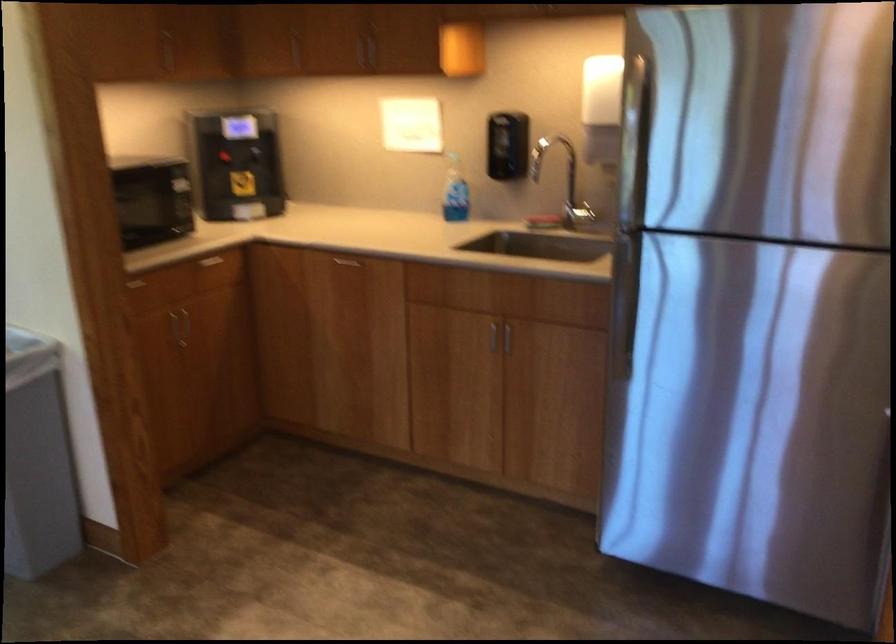
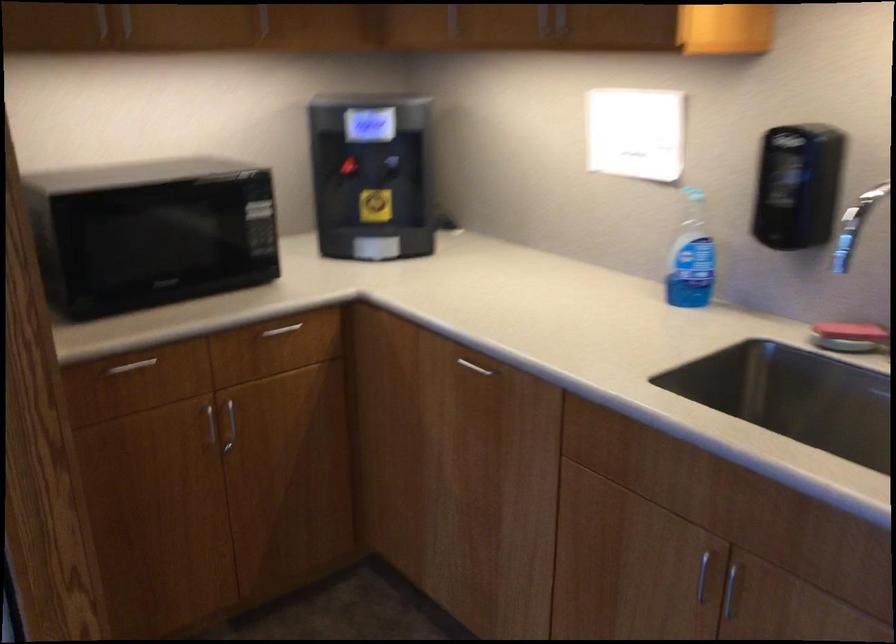
Where in the second image is the point corresponding to pixel 546 144 from the first image?

(867, 200)